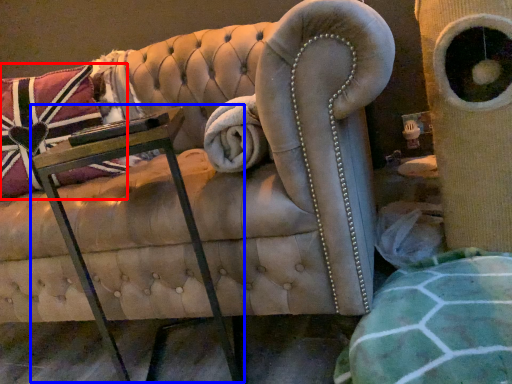
Question: Which object is further to the camera taking this photo, throw pillow (highlighted by a red box) or table (highlighted by a blue box)?

Choices:
 (A) throw pillow
 (B) table

Answer: (A)